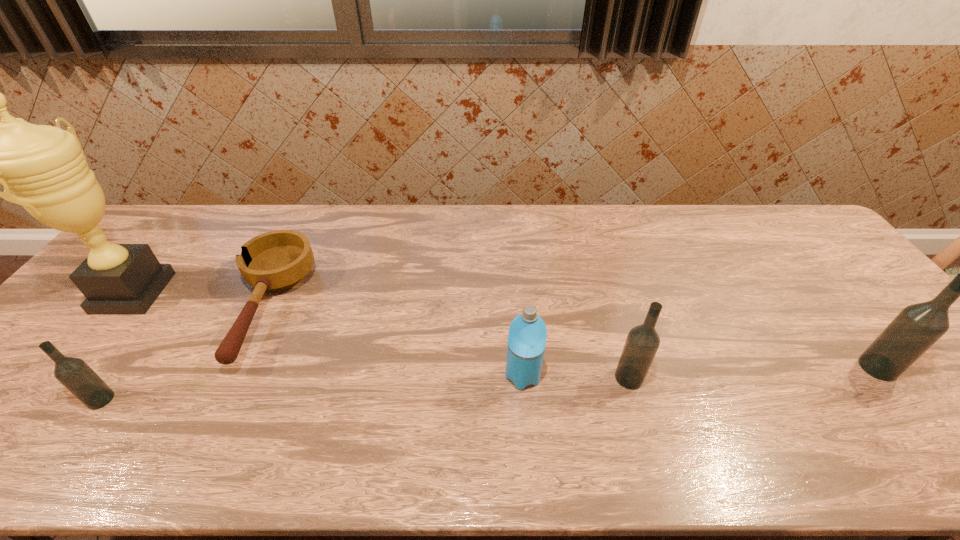
At what (x,y) coordinates should I click in order to perform the action: click on spot to insert another vodka for uniform distribution. Please return your answer as a coordinate pair (x, y). The image size is (960, 540). Looking at the image, I should click on (371, 388).